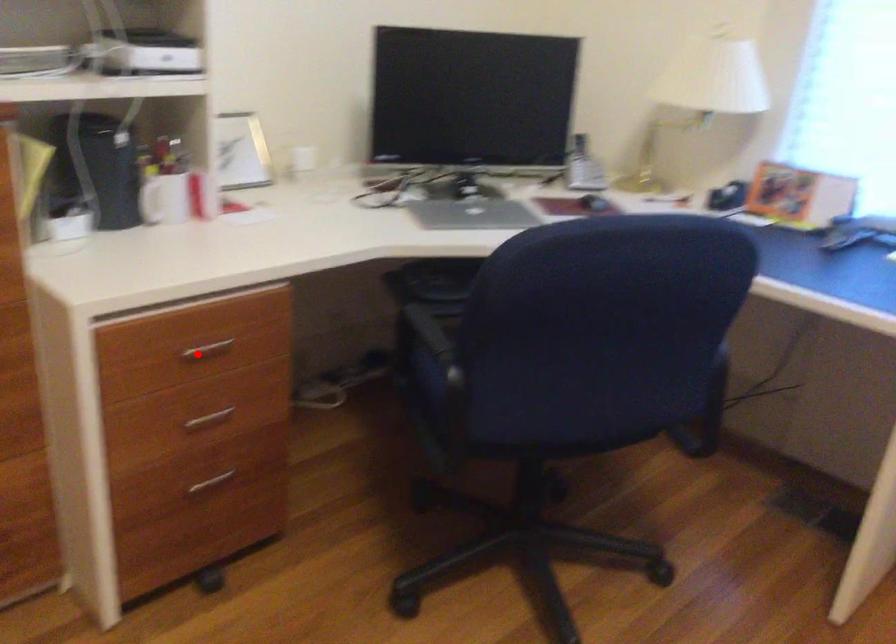
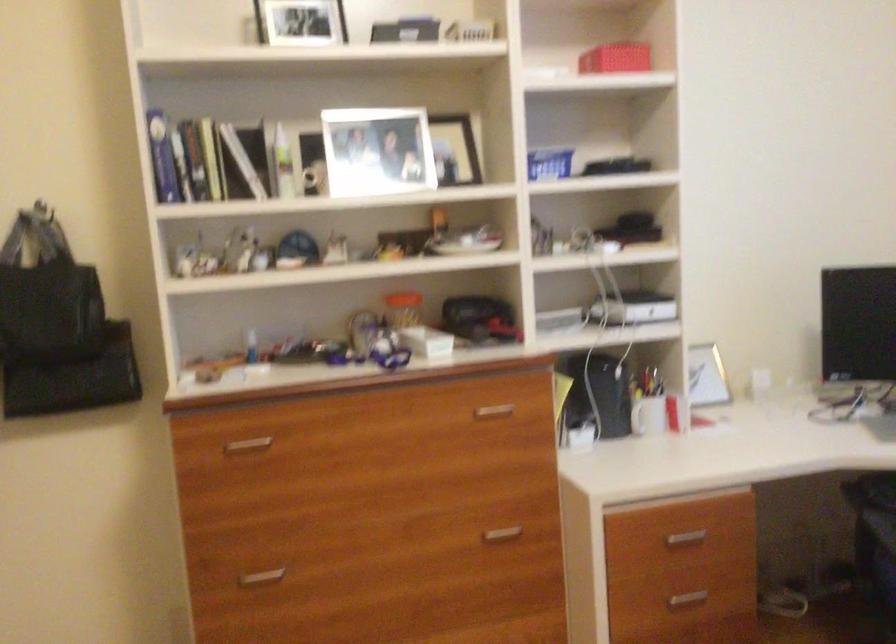
Question: I am providing you with two images of the same scene from different viewpoints. Given a red point in image1, look at the same physical point in image2. Is it:

Choices:
 (A) Closer to the viewpoint
 (B) Farther from the viewpoint

Answer: (B)